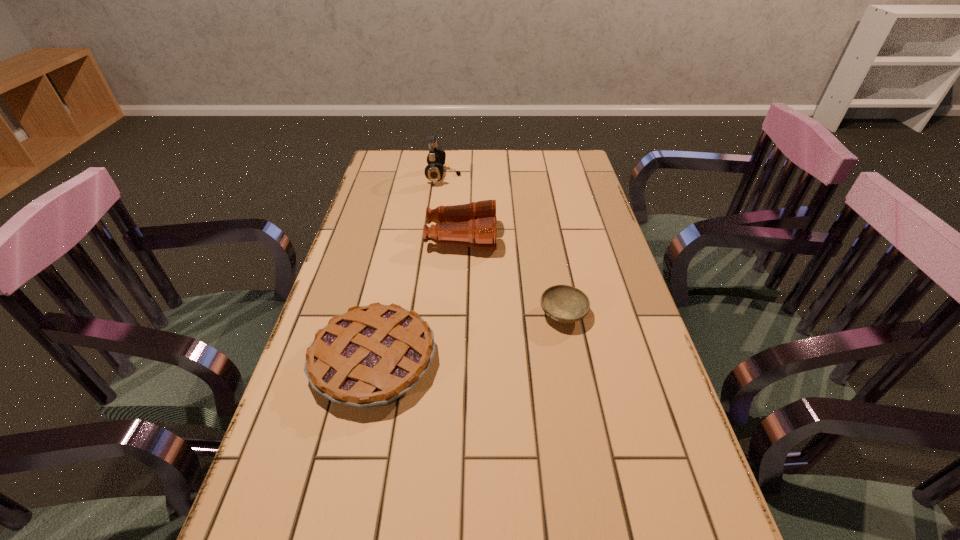
You are a GUI agent. You are given a task and a screenshot of the screen. Output one action in this format:
    pyautogui.click(x=<x>, y=<y>)
    Task: Click on the farthest object
    This screenshot has width=960, height=540.
    Given the screenshot: What is the action you would take?
    pyautogui.click(x=434, y=171)

The width and height of the screenshot is (960, 540). What are the coordinates of `headset` in the screenshot? It's located at (434, 171).

Where is `the third shortest object`? the third shortest object is located at coordinates (475, 224).

Find the location of a particular element. The width and height of the screenshot is (960, 540). the third nearest object is located at coordinates (475, 224).

You are a GUI agent. You are given a task and a screenshot of the screen. Output one action in this format:
    pyautogui.click(x=<x>, y=<y>)
    Task: Click on the third tallest object
    
    Given the screenshot: What is the action you would take?
    pyautogui.click(x=370, y=356)

Identify the location of the shortest object. (563, 303).

The image size is (960, 540). Find the location of `the rightmost object`. the rightmost object is located at coordinates (563, 303).

This screenshot has height=540, width=960. Find the location of `vacant space located 0.060m with the microphone on the side of the farthest object`. vacant space located 0.060m with the microphone on the side of the farthest object is located at coordinates (477, 177).

The width and height of the screenshot is (960, 540). I want to click on vacant space located through the lenses of the third nearest object, so click(532, 238).

At what (x,y) coordinates should I click in order to perform the action: click on free space located 0.060m on the right of the pie. Please return your answer as a coordinate pair (x, y). Image resolution: width=960 pixels, height=540 pixels. Looking at the image, I should click on (463, 361).